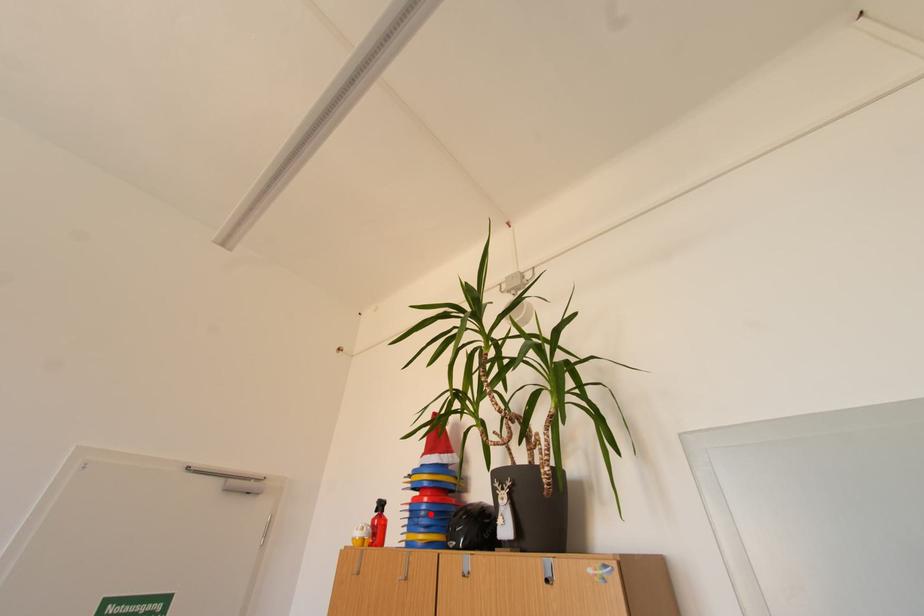
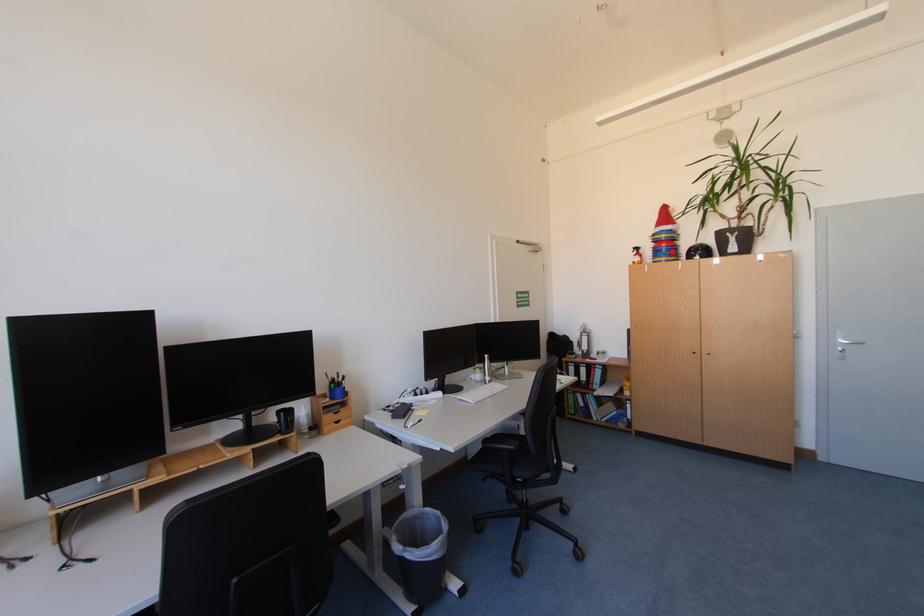
I am providing you with two images of the same scene from different viewpoints. A red point is marked on the first image and another point is marked on the second image. Is the marked point in image1 the same physical position as the marked point in image2?

Yes